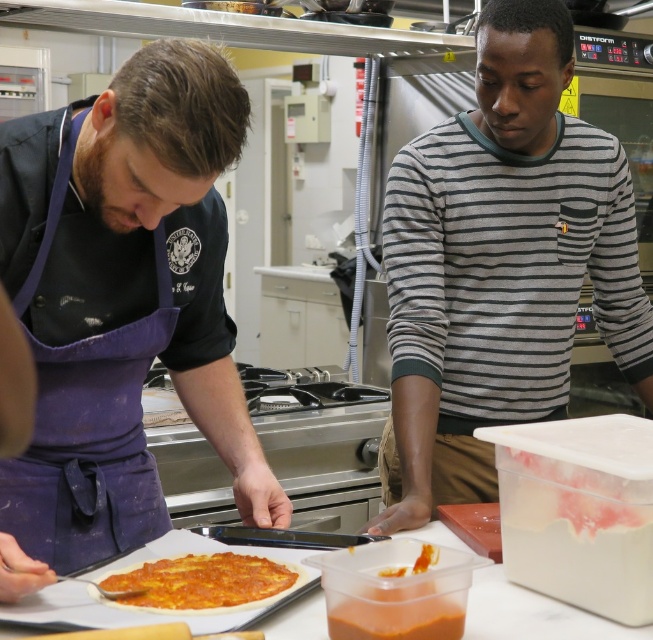
Question: Estimate the real-world distances between objects in this image. Which object is farther from the yellow cheese pizza at center?

Choices:
 (A) gray striped sweater at center
 (B) smooth orange sauce at center
 (C) purple apron at left

Answer: (A)

Question: Considering the real-world distances, which object is farthest from the purple apron at left?

Choices:
 (A) yellow cheese pizza at center
 (B) gray striped sweater at center
 (C) smooth orange sauce at center

Answer: (B)

Question: Estimate the real-world distances between objects in this image. Which object is closer to the smooth orange sauce at center?

Choices:
 (A) yellow cheese pizza at center
 (B) gray striped sweater at center
 (C) purple apron at left

Answer: (A)

Question: Does gray striped sweater at center have a larger size compared to yellow cheese pizza at center?

Choices:
 (A) yes
 (B) no

Answer: (A)

Question: Can you confirm if purple apron at left is bigger than smooth orange sauce at center?

Choices:
 (A) no
 (B) yes

Answer: (B)

Question: Does gray striped sweater at center appear on the right side of smooth orange sauce at center?

Choices:
 (A) no
 (B) yes

Answer: (B)